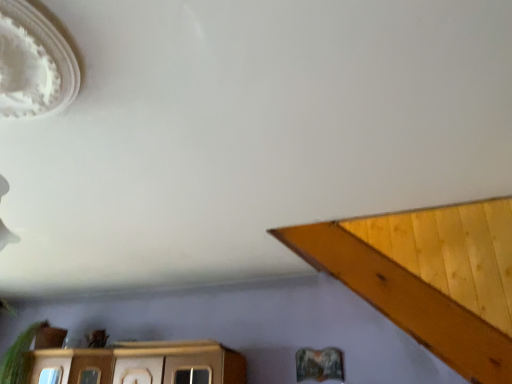
You are a GUI agent. You are given a task and a screenshot of the screen. Output one action in this format:
    pyautogui.click(x=<x>, y=<y>)
    Task: Click on the green leafy plant at lower left
    The image size is (512, 384).
    Given the screenshot: What is the action you would take?
    pyautogui.click(x=19, y=356)

The height and width of the screenshot is (384, 512). What do you see at coordinates (19, 356) in the screenshot? I see `green leafy plant at lower left` at bounding box center [19, 356].

The height and width of the screenshot is (384, 512). Identify the location of green leafy plant at lower left. (19, 356).